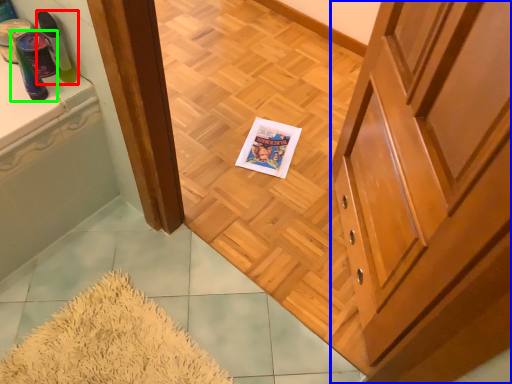
Question: Estimate the real-world distances between objects in this image. Which object is closer to toiletry (highlighted by a red box), cabinetry (highlighted by a blue box) or toiletry (highlighted by a green box)?

Choices:
 (A) cabinetry
 (B) toiletry

Answer: (B)